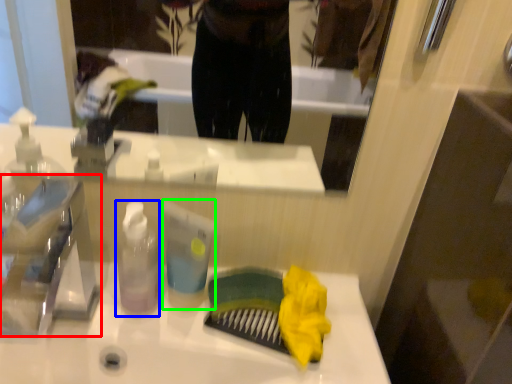
Question: Considering the real-world distances, which object is farthest from faucet (highlighted by a red box)? bottle (highlighted by a blue box) or toiletry (highlighted by a green box)?

Choices:
 (A) bottle
 (B) toiletry

Answer: (B)